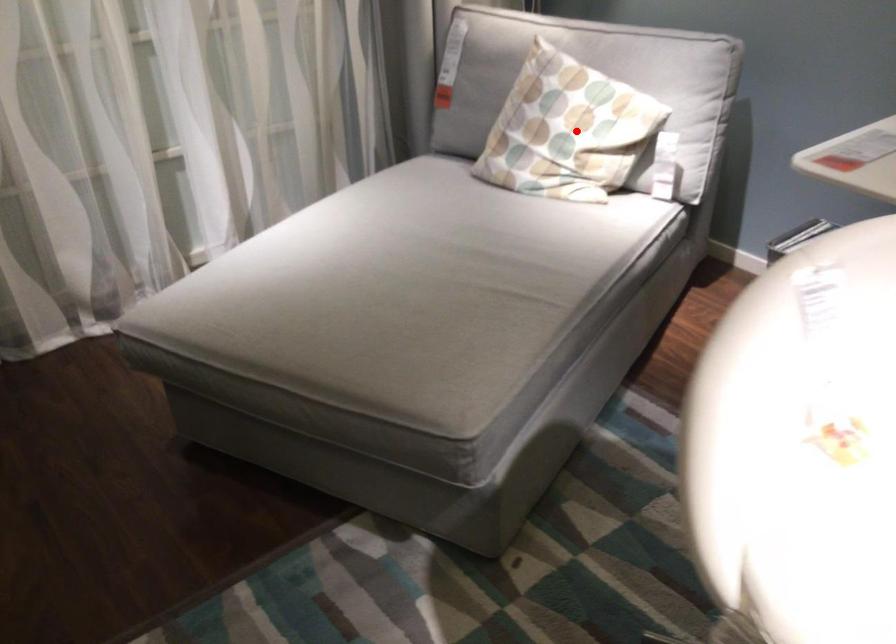
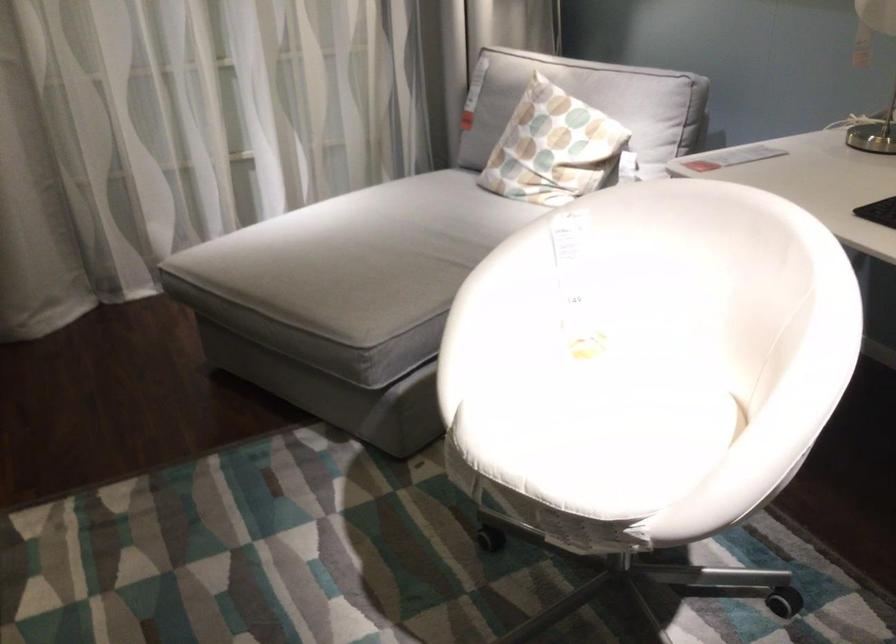
Locate, in the second image, the point that corresponds to the highlighted location in the first image.

(553, 147)